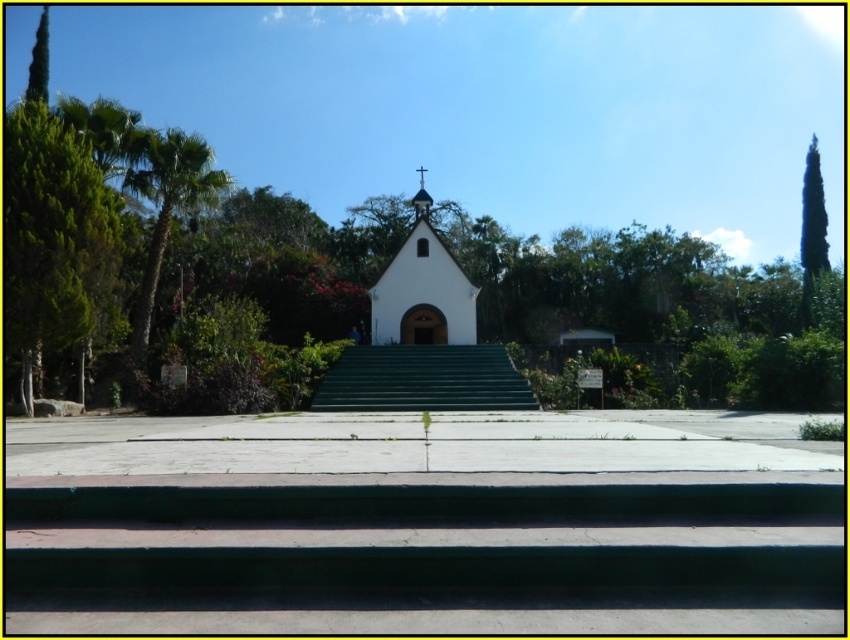
Question: Estimate the real-world distances between objects in this image. Which object is closer to the green leafy palm tree at left?

Choices:
 (A) metallic cross at upper center
 (B) concrete steps at center
 (C) white matte chapel at center

Answer: (C)

Question: Which point is farther to the camera?

Choices:
 (A) coord(809,301)
 (B) coord(43,4)
 (C) coord(389,308)

Answer: (B)

Question: Estimate the real-world distances between objects in this image. Which object is farther from the green concrete stairs at center?

Choices:
 (A) green leafy palm tree at left
 (B) green leafy tree at upper right
 (C) concrete steps at center
 (D) metallic cross at upper center

Answer: (D)

Question: Observing the image, what is the correct spatial positioning of concrete steps at center in reference to metallic cross at upper center?

Choices:
 (A) above
 (B) below

Answer: (B)

Question: Can you confirm if white matte chapel at center is positioned above green leafy palm tree at left?

Choices:
 (A) yes
 (B) no

Answer: (B)

Question: Observing the image, what is the correct spatial positioning of white matte chapel at center in reference to green leafy tree at upper right?

Choices:
 (A) right
 (B) left

Answer: (B)